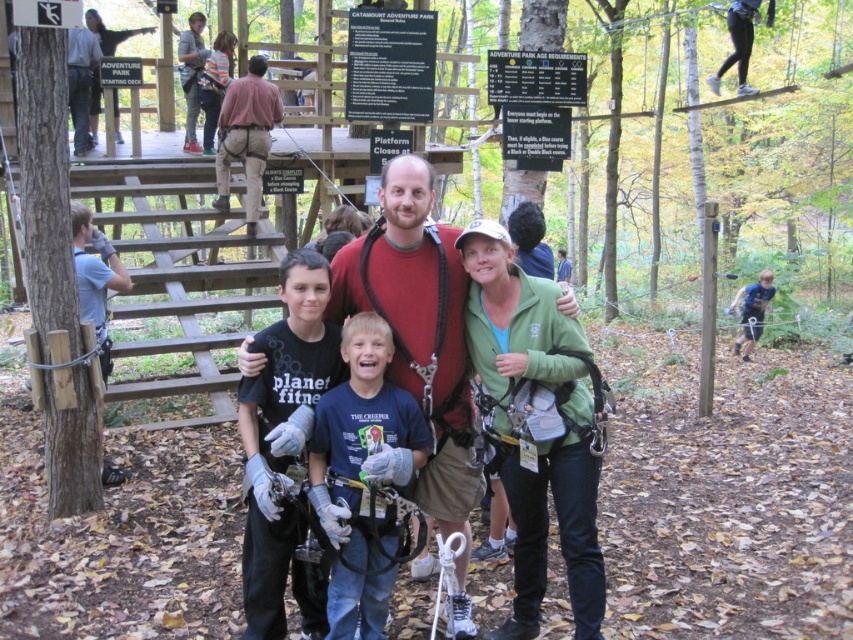
Does blue cotton shirt at center appear over black cotton shirt at center?

No.

Is blue cotton shirt at center shorter than black cotton shirt at center?

Correct, blue cotton shirt at center is not as tall as black cotton shirt at center.

Image resolution: width=853 pixels, height=640 pixels. What are the coordinates of `blue cotton shirt at center` in the screenshot? It's located at (363, 476).

Can you confirm if matte red shirt at center is smaller than brown leather pants at upper center?

Indeed, matte red shirt at center has a smaller size compared to brown leather pants at upper center.

Between matte red shirt at center and brown leather pants at upper center, which one appears on the left side from the viewer's perspective?

From the viewer's perspective, brown leather pants at upper center appears more on the left side.

Find the location of a particular element. The height and width of the screenshot is (640, 853). matte red shirt at center is located at coordinates (421, 340).

At what (x,y) coordinates should I click in order to perform the action: click on matte red shirt at center. Please return your answer as a coordinate pair (x, y). This screenshot has height=640, width=853. Looking at the image, I should click on (421, 340).

Is green softshell jacket at center smaller than matte red shirt at center?

Yes, green softshell jacket at center is smaller than matte red shirt at center.

Which is above, green softshell jacket at center or matte red shirt at center?

Positioned higher is matte red shirt at center.

Who is more forward, (572, 588) or (345, 278)?

Point (572, 588) is more forward.

Find the location of a particular element. This screenshot has width=853, height=640. green softshell jacket at center is located at coordinates (535, 426).